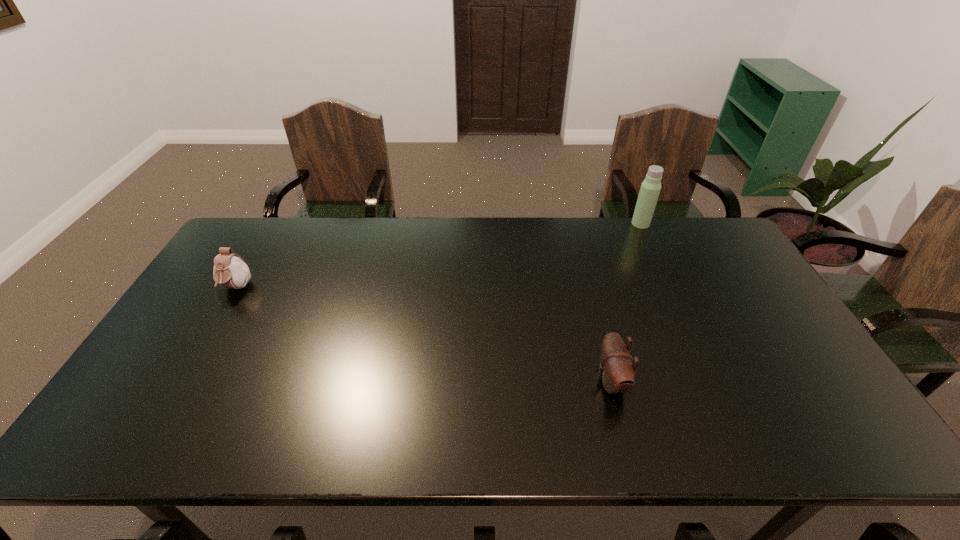
Identify the location of free point that satisfies the following two spatial constraints: 1. on the front side of the farthest object; 2. with the flap open on the right pouch. (714, 381).

Locate an element on the screen. The width and height of the screenshot is (960, 540). free space that satisfies the following two spatial constraints: 1. on the front side of the thermos bottle; 2. with the flap open on the nearer pouch is located at coordinates (714, 381).